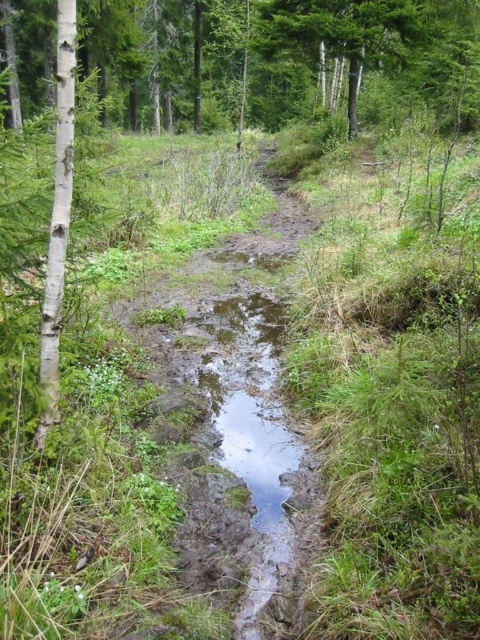
Is green matte tree at upper center thinner than white smooth tree at left?

No.

Does green matte tree at upper center appear on the right side of white smooth tree at left?

In fact, green matte tree at upper center is to the left of white smooth tree at left.

Where is `green matte tree at upper center`? This screenshot has height=640, width=480. green matte tree at upper center is located at coordinates (266, 52).